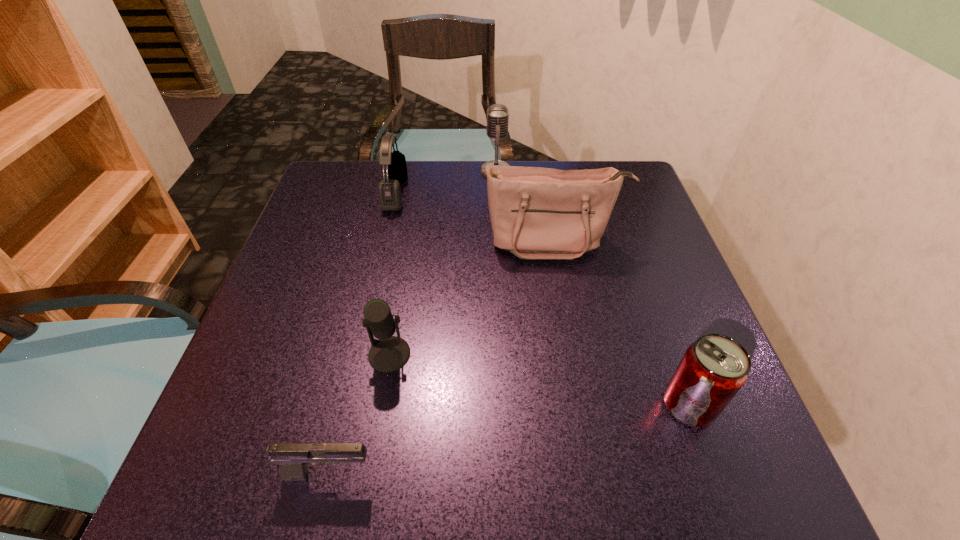
Where is `free space located on the front pocket of the fourth nearest object`? This screenshot has width=960, height=540. free space located on the front pocket of the fourth nearest object is located at coordinates (564, 303).

This screenshot has width=960, height=540. In order to click on free space located 0.240m on the headband of the headset in this screenshot , I will do `click(497, 193)`.

The width and height of the screenshot is (960, 540). Find the location of `blank space located 0.090m on the left of the left microphone`. blank space located 0.090m on the left of the left microphone is located at coordinates (320, 354).

Image resolution: width=960 pixels, height=540 pixels. Find the location of `vacant space located 0.400m on the left of the pop soda`. vacant space located 0.400m on the left of the pop soda is located at coordinates (423, 404).

Identify the location of vacant space located 0.220m aim along the barrel of the shortest object. (522, 474).

Image resolution: width=960 pixels, height=540 pixels. Find the location of `microphone situated at the far edge`. microphone situated at the far edge is located at coordinates (497, 114).

You are a GUI agent. You are given a task and a screenshot of the screen. Output one action in this format:
    pyautogui.click(x=<x>, y=<y>)
    Task: Click on the headset that is at the far edge
    Image resolution: width=960 pixels, height=540 pixels.
    Given the screenshot: What is the action you would take?
    pyautogui.click(x=390, y=196)

The height and width of the screenshot is (540, 960). I want to click on object that is at the near edge, so click(293, 458).

You are a GUI agent. You are given a task and a screenshot of the screen. Output one action in this format:
    pyautogui.click(x=<x>, y=<y>)
    Task: Click on the object that is at the left edge
    
    Given the screenshot: What is the action you would take?
    pyautogui.click(x=293, y=458)

Locate an element on the screen. This screenshot has height=540, width=960. shoulder bag that is at the right edge is located at coordinates (536, 213).